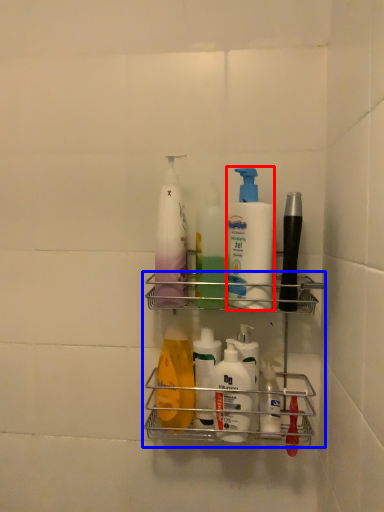
Question: Among these objects, which one is farthest to the camera, cleaning product (highlighted by a red box) or shelf (highlighted by a blue box)?

Choices:
 (A) cleaning product
 (B) shelf

Answer: (A)